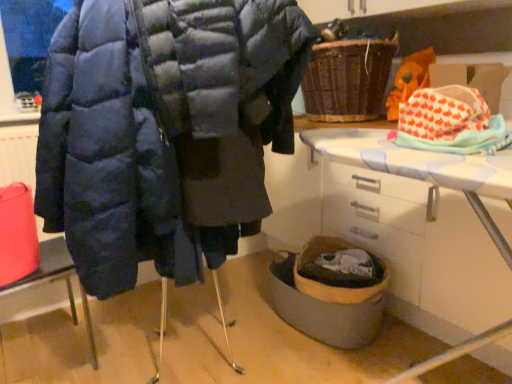
Where is `free space that is in between wooden woven basket at lower center and matte black coat at left`? free space that is in between wooden woven basket at lower center and matte black coat at left is located at coordinates coord(197,342).